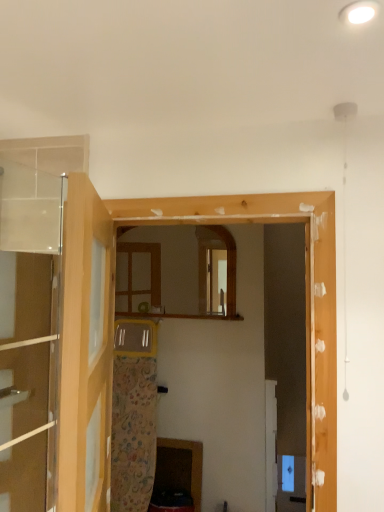
Question: From a real-world perspective, is wooden cabinet at lower center located higher than transparent glass door at left, which is the 1th door from left to right?

Choices:
 (A) no
 (B) yes

Answer: (A)

Question: From the image's perspective, is wooden cabinet at lower center below transparent glass door at left, which is the 1th door from left to right?

Choices:
 (A) yes
 (B) no

Answer: (A)

Question: Is wooden cabinet at lower center facing away from transparent glass door at left, the second door from the right?

Choices:
 (A) no
 (B) yes

Answer: (A)

Question: From a real-world perspective, is wooden cabinet at lower center positioned under transparent glass door at left, the second door from the right, based on gravity?

Choices:
 (A) yes
 (B) no

Answer: (A)

Question: Considering the relative sizes of wooden cabinet at lower center and transparent glass door at left, the second door from the right, in the image provided, is wooden cabinet at lower center shorter than transparent glass door at left, the second door from the right,?

Choices:
 (A) no
 (B) yes

Answer: (B)

Question: Is wooden cabinet at lower center positioned in front of transparent glass door at left, which is the 1th door from left to right?

Choices:
 (A) yes
 (B) no

Answer: (B)

Question: Is clear glass door at upper left, placed as the first door when sorted from right to left, positioned with its back to wooden cabinet at lower center?

Choices:
 (A) yes
 (B) no

Answer: (B)

Question: Can wooden cabinet at lower center be found inside clear glass door at upper left, the 2th door viewed from the left?

Choices:
 (A) yes
 (B) no

Answer: (B)

Question: Can you confirm if clear glass door at upper left, placed as the first door when sorted from right to left, is shorter than wooden cabinet at lower center?

Choices:
 (A) no
 (B) yes

Answer: (A)

Question: From the image's perspective, is clear glass door at upper left, the 2th door viewed from the left, located above wooden cabinet at lower center?

Choices:
 (A) yes
 (B) no

Answer: (A)

Question: Is there a large distance between clear glass door at upper left, placed as the first door when sorted from right to left, and wooden cabinet at lower center?

Choices:
 (A) no
 (B) yes

Answer: (B)

Question: Does clear glass door at upper left, the 2th door viewed from the left, have a greater width compared to wooden cabinet at lower center?

Choices:
 (A) yes
 (B) no

Answer: (A)

Question: Is wooden frame at center wider than wooden cabinet at lower center?

Choices:
 (A) yes
 (B) no

Answer: (A)